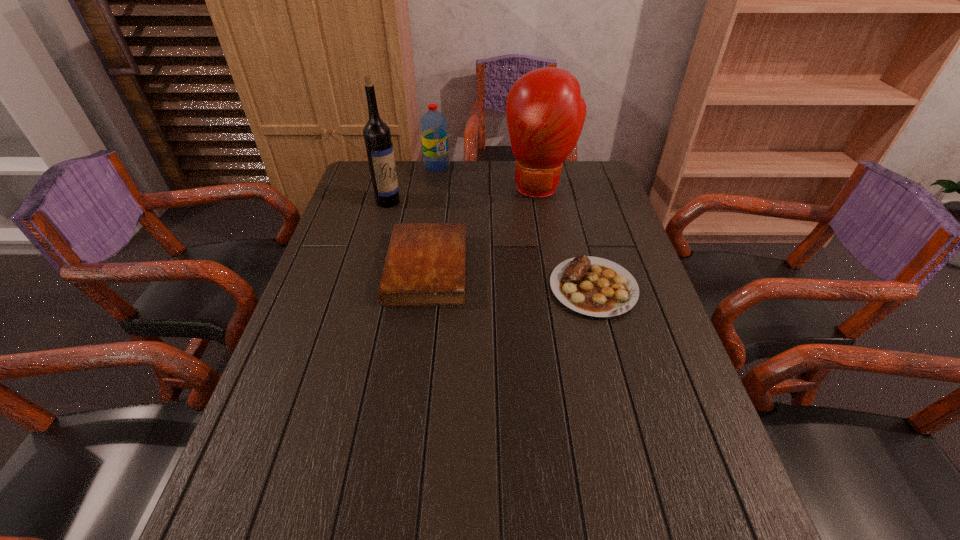
Find the location of a particular element. This screenshot has width=960, height=540. empty space that is in between the steak and the wine bottle is located at coordinates (491, 245).

Find the location of a particular element. The width and height of the screenshot is (960, 540). object that is the nearest to the boxing glove is located at coordinates (434, 133).

Locate which object is the second closest to the wine bottle. Please provide its 2D coordinates. Your answer should be formatted as a tuple, i.e. [(x, y)], where the tuple contains the x and y coordinates of a point satisfying the conditions above.

[(434, 133)]

Find the location of a particular element. vacant space that satisfies the following two spatial constraints: 1. on the front side of the Bible; 2. on the spine side of the water bottle is located at coordinates (422, 268).